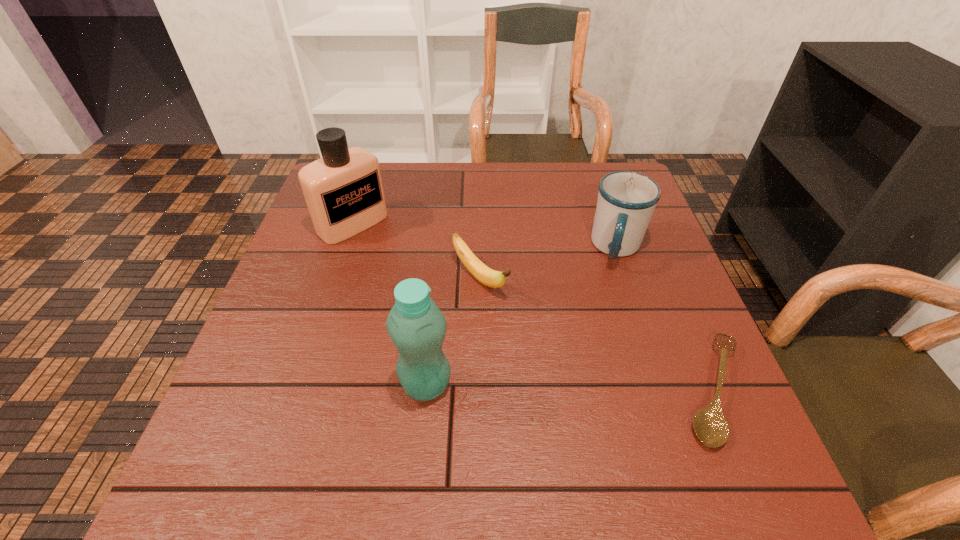
Find the location of `water bottle`. water bottle is located at coordinates (417, 327).

The height and width of the screenshot is (540, 960). In order to click on ladle in this screenshot , I will do `click(710, 425)`.

Find the location of a particular element. The width and height of the screenshot is (960, 540). the leftmost object is located at coordinates (343, 190).

You are a GUI agent. You are given a task and a screenshot of the screen. Output one action in this format:
    pyautogui.click(x=<x>, y=<y>)
    Task: Click on the mug
    Image resolution: width=960 pixels, height=540 pixels.
    Given the screenshot: What is the action you would take?
    pyautogui.click(x=626, y=201)

I want to click on banana, so click(x=485, y=275).

Where is `vacant area located 0.230m at the front cap of the water bottle`? Image resolution: width=960 pixels, height=540 pixels. vacant area located 0.230m at the front cap of the water bottle is located at coordinates (575, 384).

The height and width of the screenshot is (540, 960). Identify the location of blank space located 0.190m on the left of the shortest object. (573, 390).

At what (x,y) coordinates should I click in order to perform the action: click on blank space located on the front label of the leftmost object. Please return your answer as a coordinate pair (x, y). Looking at the image, I should click on (468, 318).

Find the location of a particular element. This screenshot has width=960, height=540. vacant area situated on the front label of the leftmost object is located at coordinates (397, 260).

You are a GUI agent. You are given a task and a screenshot of the screen. Output one action in this format:
    pyautogui.click(x=<x>, y=<y>)
    Task: Click on the free space located 0.170m on the front label of the leftmost object
    The image size is (960, 540).
    Given the screenshot: What is the action you would take?
    pyautogui.click(x=413, y=273)